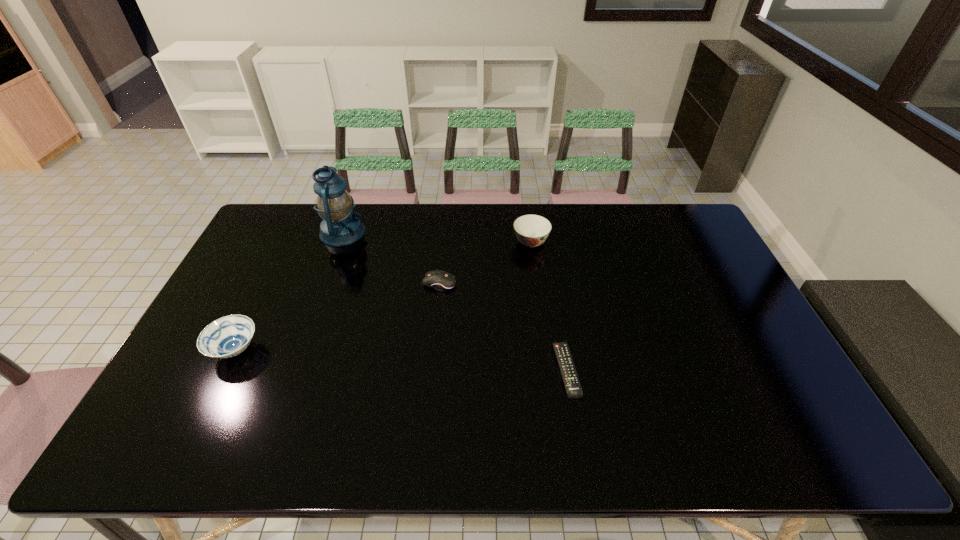
This screenshot has width=960, height=540. I want to click on free region at the far right corner of the desktop, so click(693, 227).

In the image, there is a desktop. Where is `vacant space at the near right corner`? Image resolution: width=960 pixels, height=540 pixels. vacant space at the near right corner is located at coordinates (776, 431).

Where is `empty space that is in between the third object from left to right and the remote control`? empty space that is in between the third object from left to right and the remote control is located at coordinates (503, 327).

Where is `empty location between the right soup bowl and the shortest object`? The image size is (960, 540). empty location between the right soup bowl and the shortest object is located at coordinates (548, 306).

Locate an element on the screen. free spot between the lantern and the right soup bowl is located at coordinates (437, 238).

The width and height of the screenshot is (960, 540). Find the location of `free space between the shortest object and the nearer soup bowl`. free space between the shortest object and the nearer soup bowl is located at coordinates (401, 360).

Image resolution: width=960 pixels, height=540 pixels. I want to click on unoccupied position between the computer mouse and the second object from left to right, so click(x=392, y=258).

Identify the location of unoccupied position between the left soup bowl and the farther soup bowl. This screenshot has width=960, height=540. [383, 296].

Image resolution: width=960 pixels, height=540 pixels. Find the location of `free space between the farther soup bowl and the third farthest object`. free space between the farther soup bowl and the third farthest object is located at coordinates click(486, 263).

Where is `free space between the right soup bowl and the shortest object`? The image size is (960, 540). free space between the right soup bowl and the shortest object is located at coordinates (548, 306).